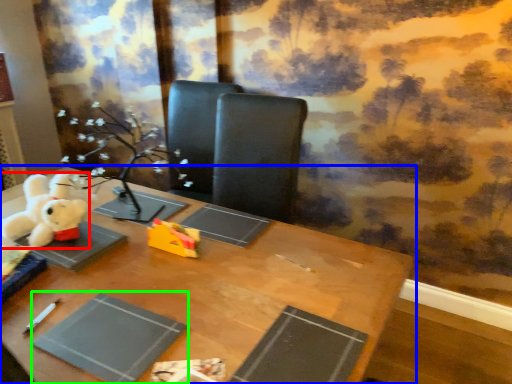
Question: Which object is positioned farthest from toy (highlighted by a red box)? Select from table (highlighted by a blue box) and paperback book (highlighted by a green box).

Choices:
 (A) table
 (B) paperback book

Answer: (B)